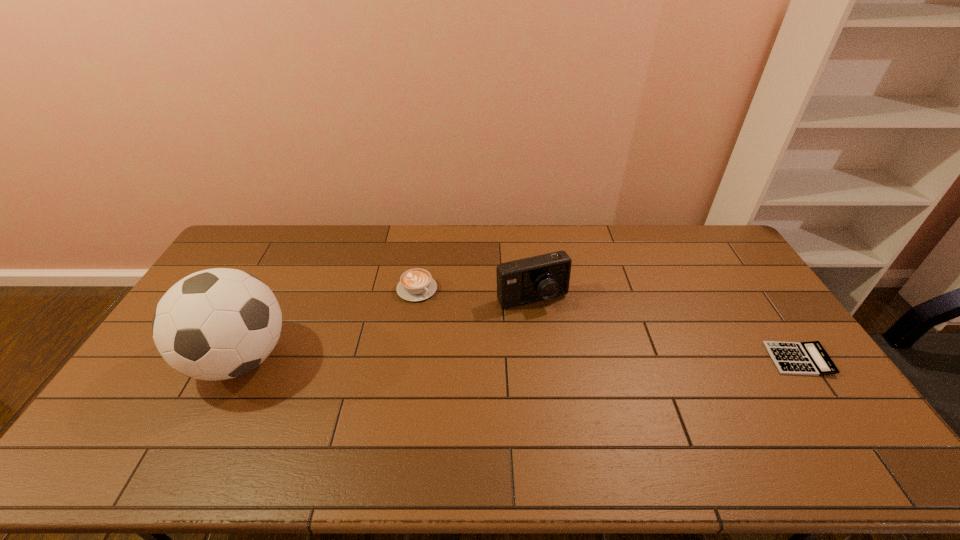
Find the location of a particular element. The width and height of the screenshot is (960, 540). blank space that satisfies the following two spatial constraints: 1. on the front side of the second object from left to right; 2. on the left side of the shortest object is located at coordinates (406, 359).